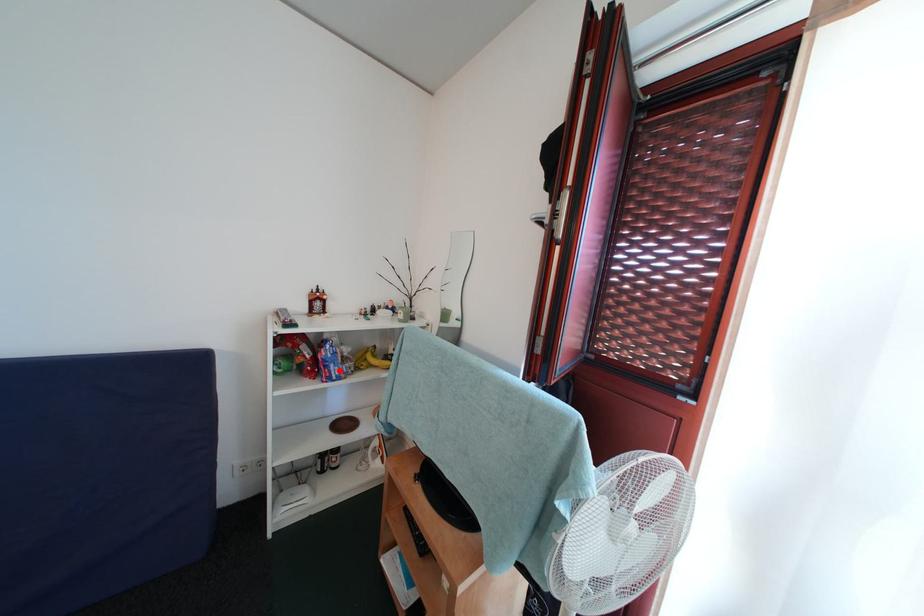
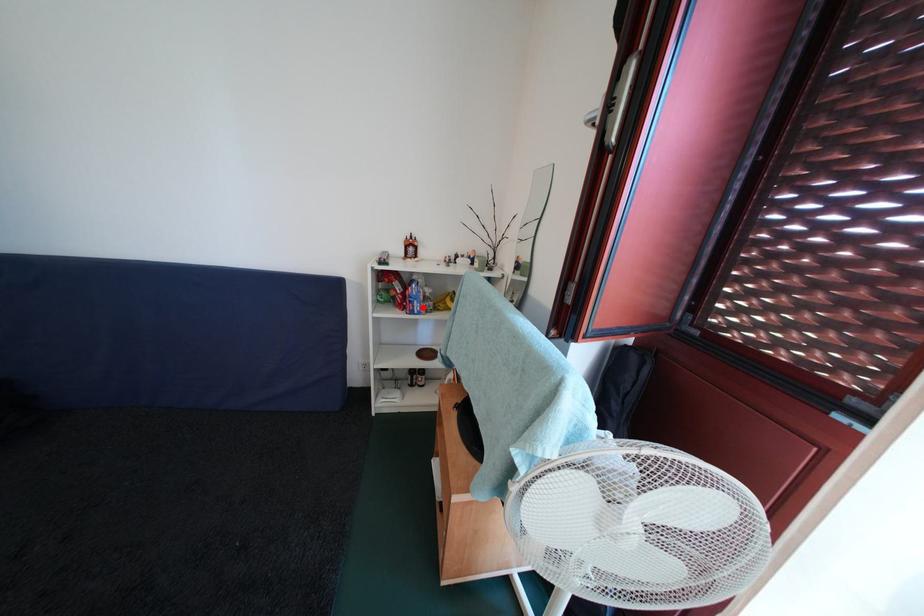
I am providing you with two images of the same scene from different viewpoints. A red point is marked on the first image and another point is marked on the second image. Does the point marked in image1 correspond to the same location as the one in image2?

Yes